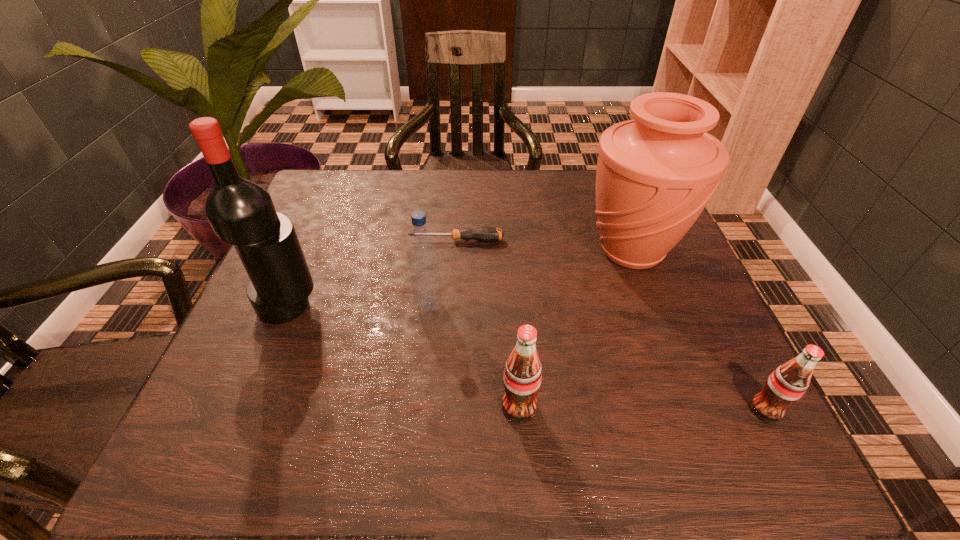
I want to click on the taller soda, so click(x=522, y=378).

The height and width of the screenshot is (540, 960). I want to click on the third shortest object, so click(x=522, y=378).

Where is `the shorter soda`? This screenshot has width=960, height=540. the shorter soda is located at coordinates (787, 384).

Where is `the second shortest object`? Image resolution: width=960 pixels, height=540 pixels. the second shortest object is located at coordinates (787, 384).

Where is `screwdriver`? The image size is (960, 540). screwdriver is located at coordinates (485, 234).

The height and width of the screenshot is (540, 960). I want to click on vase, so click(655, 174).

Image resolution: width=960 pixels, height=540 pixels. Identify the location of water bottle. (422, 251).

Where is `wine bottle`? Image resolution: width=960 pixels, height=540 pixels. wine bottle is located at coordinates (241, 212).

At what (x,y) coordinates should I click in order to perform the action: click on free space located 0.370m on the back of the left soda. Please return your answer as a coordinate pair (x, y). Image resolution: width=960 pixels, height=540 pixels. Looking at the image, I should click on (508, 251).

Where is `vacant position located on the left of the right soda`? This screenshot has height=540, width=960. vacant position located on the left of the right soda is located at coordinates (623, 410).